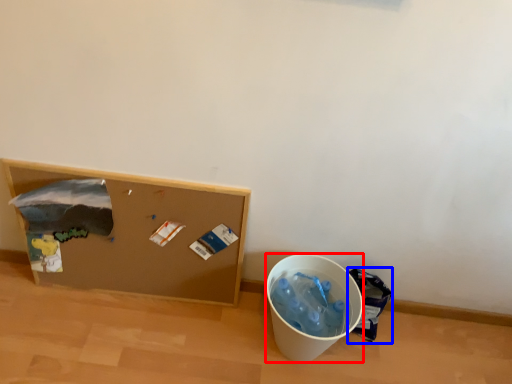
Question: Which object is further to the camera taking this photo, recycling bin (highlighted by a red box) or garbage (highlighted by a blue box)?

Choices:
 (A) recycling bin
 (B) garbage

Answer: (B)